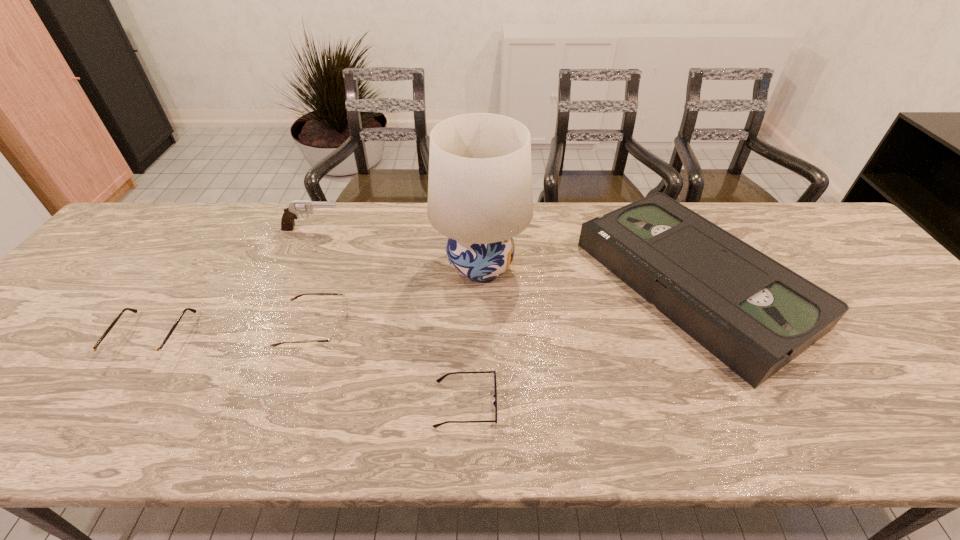
Find the location of a particular element. Image resolution: width=960 pixels, height=540 pixels. free point between the third tallest object and the leftmost object is located at coordinates (422, 310).

I want to click on free space between the lampshade and the nearest spectacles, so click(x=473, y=335).

This screenshot has height=540, width=960. Identify the location of vacant area that lies between the lampshade and the gun. (396, 247).

Where is `object that ranks as the closest to the lampshade`? This screenshot has height=540, width=960. object that ranks as the closest to the lampshade is located at coordinates 755,315.

Choose which object is the fifth nearest neighbor to the rightmost object. Please provide its 2D coordinates. Your answer should be formatted as a tuple, i.e. [(x, y)], where the tuple contains the x and y coordinates of a point satisfying the conditions above.

[(149, 354)]

Point out which spectacles is positioned as the third nearest to the gun. Please provide its 2D coordinates. Your answer should be formatted as a tuple, i.e. [(x, y)], where the tuple contains the x and y coordinates of a point satisfying the conditions above.

[(440, 379)]

Choose which spectacles is the second nearest neighbor to the gun. Please provide its 2D coordinates. Your answer should be formatted as a tuple, i.e. [(x, y)], where the tuple contains the x and y coordinates of a point satisfying the conditions above.

[(149, 354)]

This screenshot has height=540, width=960. I want to click on free space that satisfies the following two spatial constraints: 1. on the front-facing side of the third tallest object; 2. on the right side of the lampshade, so click(x=480, y=284).

You are a GUI agent. You are given a task and a screenshot of the screen. Output one action in this format:
    pyautogui.click(x=<x>, y=<y>)
    Task: Click on the vacant space that satisfies the following two spatial constraints: 1. on the front-facing side of the tallest object; 2. at the hinge ends of the leftmost object
    
    Given the screenshot: What is the action you would take?
    pyautogui.click(x=480, y=338)

Where is `free space that satisfies the following two spatial constraints: 1. on the back side of the rightmost object; 2. at the muzzle of the second tallest object`? Image resolution: width=960 pixels, height=540 pixels. free space that satisfies the following two spatial constraints: 1. on the back side of the rightmost object; 2. at the muzzle of the second tallest object is located at coordinates (666, 230).